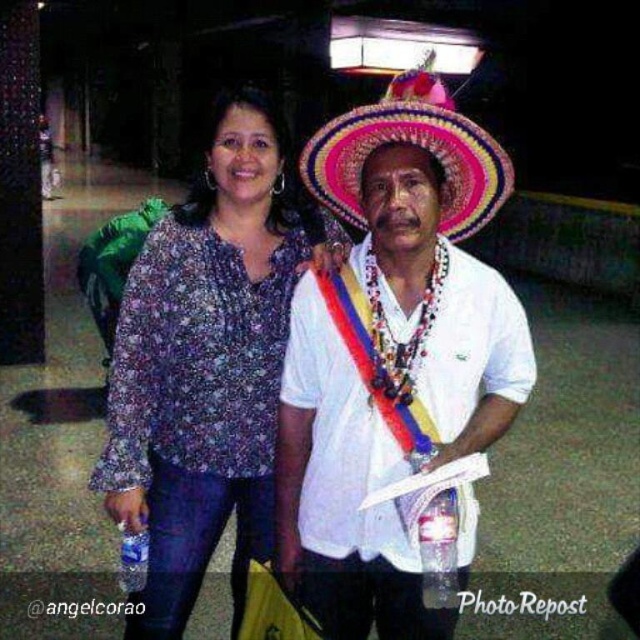
Describe the element at coordinates (392, 353) in the screenshot. I see `white woven hat at center` at that location.

The height and width of the screenshot is (640, 640). I want to click on white woven hat at center, so click(392, 353).

Does printed fabric blouse at center lie in front of brightly colored woven hat at center?

No, printed fabric blouse at center is behind brightly colored woven hat at center.

Image resolution: width=640 pixels, height=640 pixels. What do you see at coordinates (208, 364) in the screenshot?
I see `printed fabric blouse at center` at bounding box center [208, 364].

Image resolution: width=640 pixels, height=640 pixels. I want to click on printed fabric blouse at center, so click(x=208, y=364).

Is point (349, 417) farther from viewer compared to point (504, 161)?

Yes.

The width and height of the screenshot is (640, 640). Identify the location of white woven hat at center. (392, 353).

Image resolution: width=640 pixels, height=640 pixels. Describe the element at coordinates (392, 353) in the screenshot. I see `white woven hat at center` at that location.

Where is `white woven hat at center`? Image resolution: width=640 pixels, height=640 pixels. white woven hat at center is located at coordinates (392, 353).